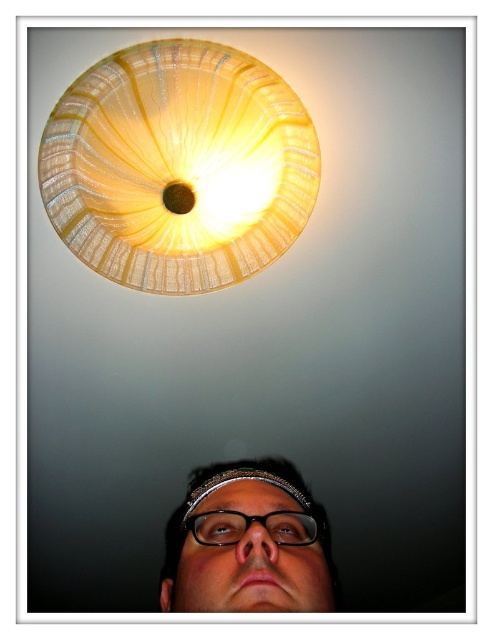
Is point (117, 51) farther from camera compared to point (208, 557)?

Yes, point (117, 51) is farther from viewer.

Which of these two, translucent glass lampshade at upper center or matte black glasses at lower center, stands shorter?

Standing shorter between the two is matte black glasses at lower center.

You are a GUI agent. You are given a task and a screenshot of the screen. Output one action in this format:
    pyautogui.click(x=<x>, y=<y>)
    Task: Click on the translucent glass lampshade at upper center
    
    Given the screenshot: What is the action you would take?
    pyautogui.click(x=178, y=166)